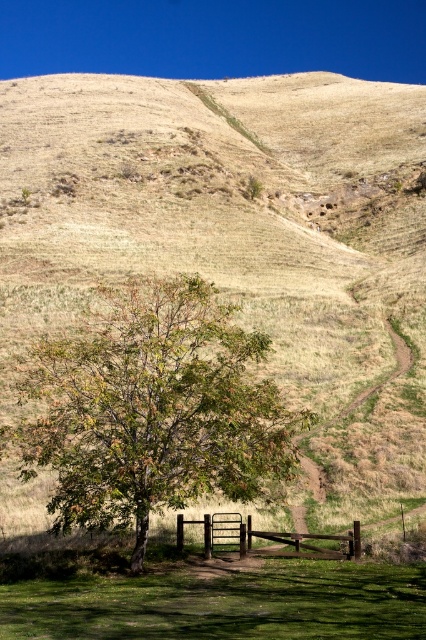
You are a painter standing at the base of the brown wooden fence at lower center, looking towards the green leafy tree at center. Which object appears taller in the scene?

The green leafy tree at center appears taller than the brown wooden fence at lower center.

You are a gardener who wants to plant flowers on the green grassy at lower center. However, you need to ensure that the brown wooden fence at lower center is not in the way. Can you plant the flowers there without disturbing the fence?

The green grassy at lower center is positioned over the brown wooden fence at lower center, meaning the grass is covering the fence. Therefore, planting flowers on the grass would require disturbing the fence underneath.

You are standing at the point with coordinates 0.5, 0.5 in the image. Which direction should you move to reach the green leafy tree at center?

To reach the green leafy tree at center from the point (x=213, y=320), you should move northeast because the tree is located at coordinates (x=154, y=412), which is northeast of your current position.